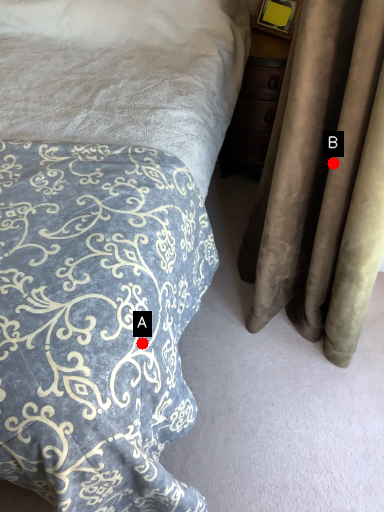
Question: Two points are circled on the image, labeled by A and B beside each circle. Which point is closer to the camera?

Choices:
 (A) A is closer
 (B) B is closer

Answer: (A)